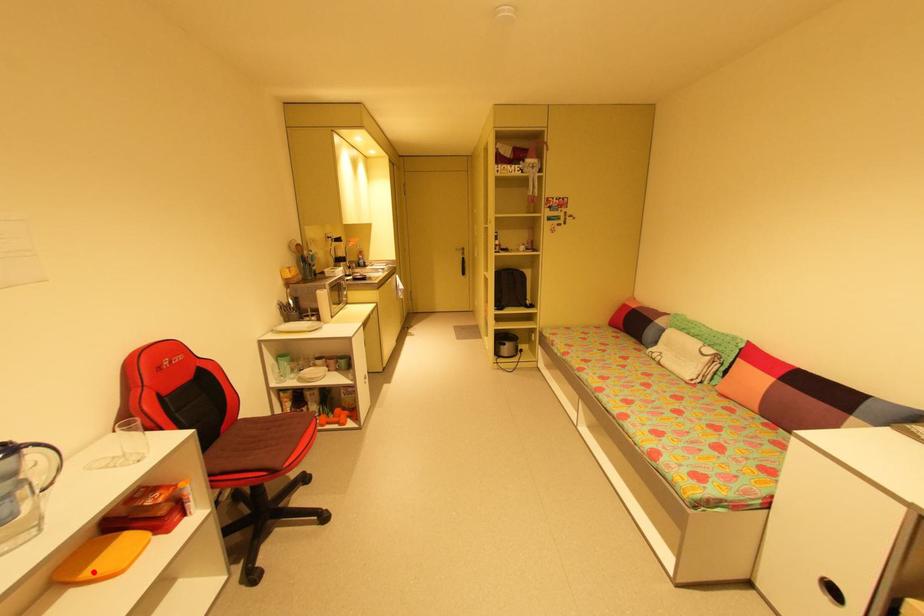
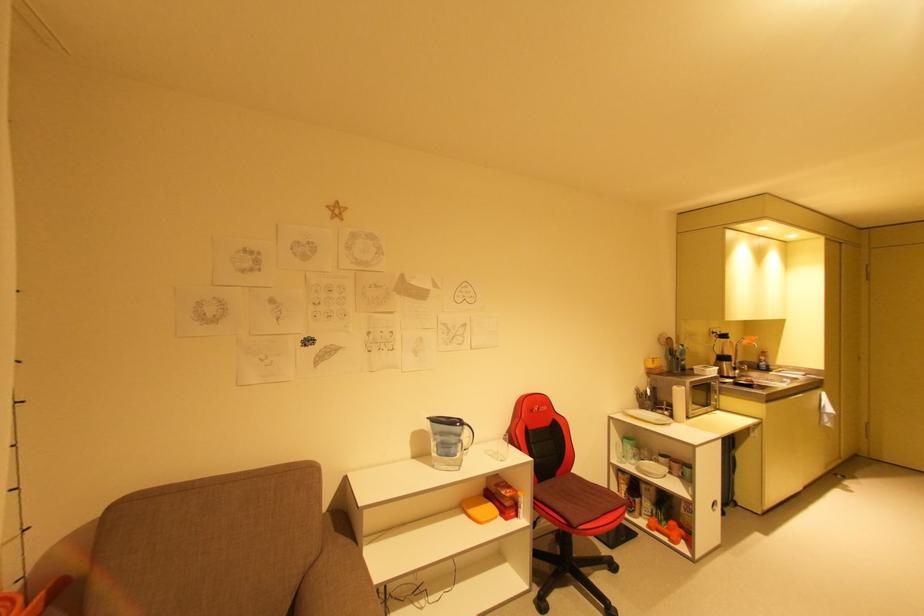
The point at the highlighted location is marked in the first image. Where is the corresponding point in the second image?

(477, 512)